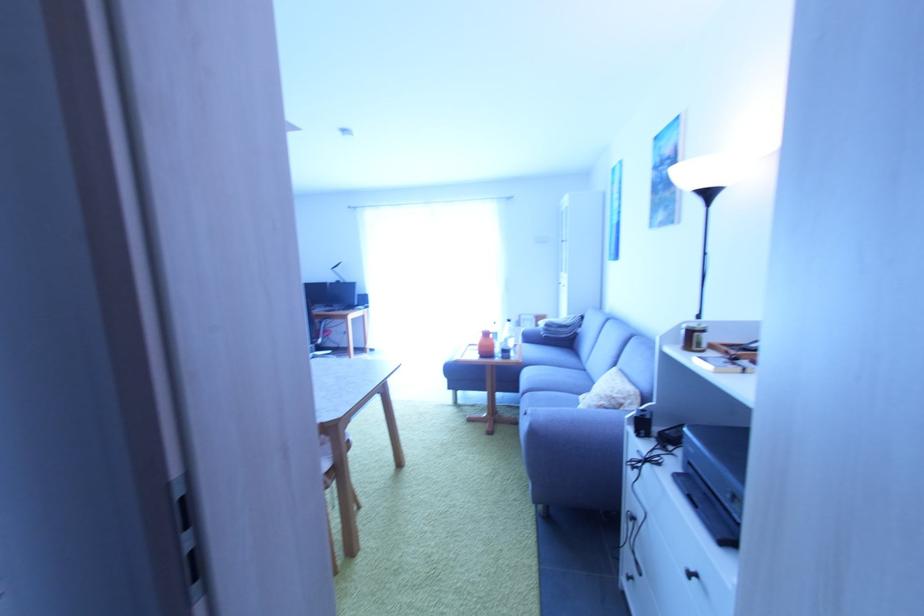
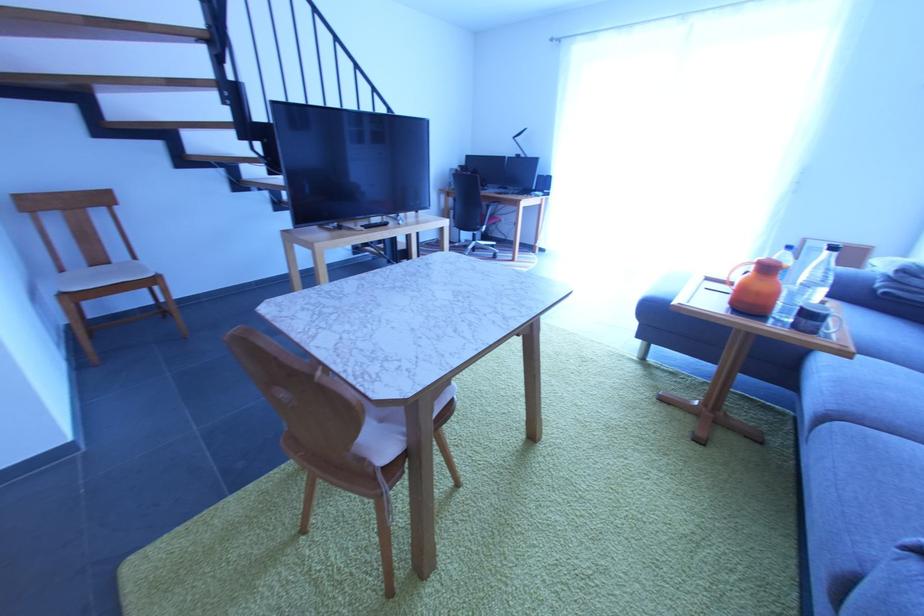
In the second image, find the point that corresponds to point 528,395 in the first image.

(833, 419)